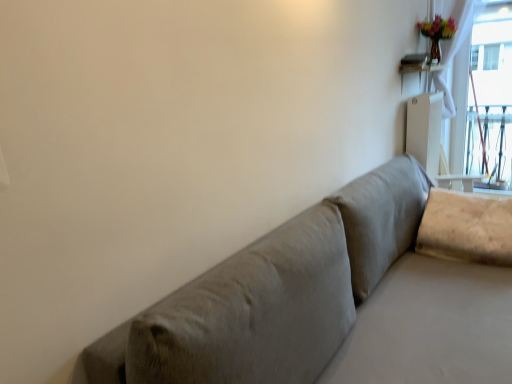
The width and height of the screenshot is (512, 384). What do you see at coordinates (418, 69) in the screenshot? I see `white glossy table at upper right` at bounding box center [418, 69].

You are a GUI agent. You are given a task and a screenshot of the screen. Output one action in this format:
    pyautogui.click(x=<x>, y=<y>)
    Task: Click on the white glossy table at upper right
    The image size is (512, 384).
    Given the screenshot: What is the action you would take?
    pyautogui.click(x=418, y=69)

In order to face white glossy table at upper right, should I rotate leftwards or rightwards?

Turn right by 21.977 degrees to look at white glossy table at upper right.

This screenshot has height=384, width=512. I want to click on beige fabric pillow at right, so click(x=466, y=227).

What do you see at coordinates (466, 227) in the screenshot? This screenshot has width=512, height=384. I see `beige fabric pillow at right` at bounding box center [466, 227].

At what (x,y) coordinates should I click in order to perform the action: click on white glossy table at upper right. Please return your answer as a coordinate pair (x, y). Image resolution: width=512 pixels, height=384 pixels. Looking at the image, I should click on (418, 69).

Considering the positions of objects beige fabric pillow at right and white glossy table at upper right in the image provided, who is more to the right, beige fabric pillow at right or white glossy table at upper right?

Positioned to the right is white glossy table at upper right.

Is the depth of beige fabric pillow at right greater than that of white glossy table at upper right?

No, beige fabric pillow at right is closer to the viewer.

Does point (463, 256) come farther from viewer compared to point (402, 59)?

No.

From the image's perspective, which is below, beige fabric pillow at right or white glossy table at upper right?

beige fabric pillow at right, from the image's perspective.

From a real-world perspective, which object stands above the other?

white glossy table at upper right is physically above.

Does beige fabric pillow at right have a lesser width compared to white glossy table at upper right?

No.

Considering the sizes of objects beige fabric pillow at right and white glossy table at upper right in the image provided, who is taller, beige fabric pillow at right or white glossy table at upper right?

beige fabric pillow at right.

Can you confirm if beige fabric pillow at right is smaller than white glossy table at upper right?

Actually, beige fabric pillow at right might be larger than white glossy table at upper right.

Would you say white glossy table at upper right is part of beige fabric pillow at right's contents?

No, white glossy table at upper right is not a part of beige fabric pillow at right.

Is beige fabric pillow at right touching white glossy table at upper right?

No.

Is beige fabric pillow at right aimed at white glossy table at upper right?

No, beige fabric pillow at right is not facing towards white glossy table at upper right.

Based on the photo, measure the distance from beige fabric pillow at right to white glossy table at upper right.

They are 1.24 meters apart.

Locate an element on the screen. The height and width of the screenshot is (384, 512). pillow that is under the white glossy table at upper right (from a real-world perspective) is located at coordinates 466,227.

Which is more to the left, white glossy table at upper right or beige fabric pillow at right?

From the viewer's perspective, beige fabric pillow at right appears more on the left side.

Considering the positions of objects white glossy table at upper right and beige fabric pillow at right in the image provided, who is behind, white glossy table at upper right or beige fabric pillow at right?

white glossy table at upper right is further from the camera.

Considering the positions of points (401, 69) and (505, 206), is point (401, 69) closer to camera compared to point (505, 206)?

No, (401, 69) is behind (505, 206).

From the image's perspective, which one is positioned lower, white glossy table at upper right or beige fabric pillow at right?

beige fabric pillow at right is shown below in the image.

From a real-world perspective, is white glossy table at upper right located higher than beige fabric pillow at right?

Yes, from a real-world perspective, white glossy table at upper right is on top of beige fabric pillow at right.

Between white glossy table at upper right and beige fabric pillow at right, which one has larger width?

With larger width is beige fabric pillow at right.

Between white glossy table at upper right and beige fabric pillow at right, which one has less height?

With less height is white glossy table at upper right.

Consider the image. Who is smaller, white glossy table at upper right or beige fabric pillow at right?

With smaller size is white glossy table at upper right.

Would you say white glossy table at upper right is outside beige fabric pillow at right?

Yes, white glossy table at upper right is outside of beige fabric pillow at right.

Is white glossy table at upper right positioned far away from beige fabric pillow at right?

white glossy table at upper right is far away from beige fabric pillow at right.

Is white glossy table at upper right aimed at beige fabric pillow at right?

No, white glossy table at upper right is not turned towards beige fabric pillow at right.

How different are the orientations of white glossy table at upper right and beige fabric pillow at right in degrees?

0.141 degrees.

Locate an element on the screen. pillow on the left of white glossy table at upper right is located at coordinates (466, 227).

Find the location of a particular element. This screenshot has height=384, width=512. pillow that is on the left side of white glossy table at upper right is located at coordinates (466, 227).

This screenshot has width=512, height=384. In order to click on table above the beige fabric pillow at right (from the image's perspective) in this screenshot , I will do `click(418, 69)`.